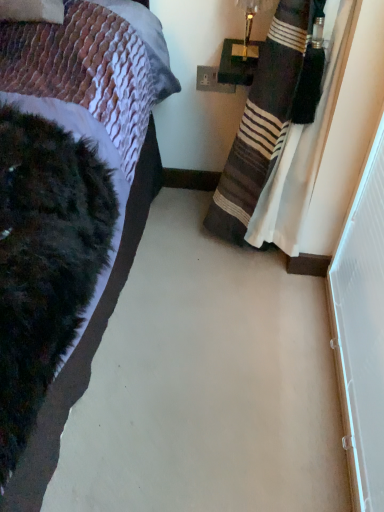
You are a GUI agent. You are given a task and a screenshot of the screen. Output one action in this format:
    pyautogui.click(x=<x>, y=<y>)
    Task: Click on the vacant space situated on the left part of striped fabric curtain at right
    The width and height of the screenshot is (384, 512).
    Given the screenshot: What is the action you would take?
    pyautogui.click(x=162, y=267)